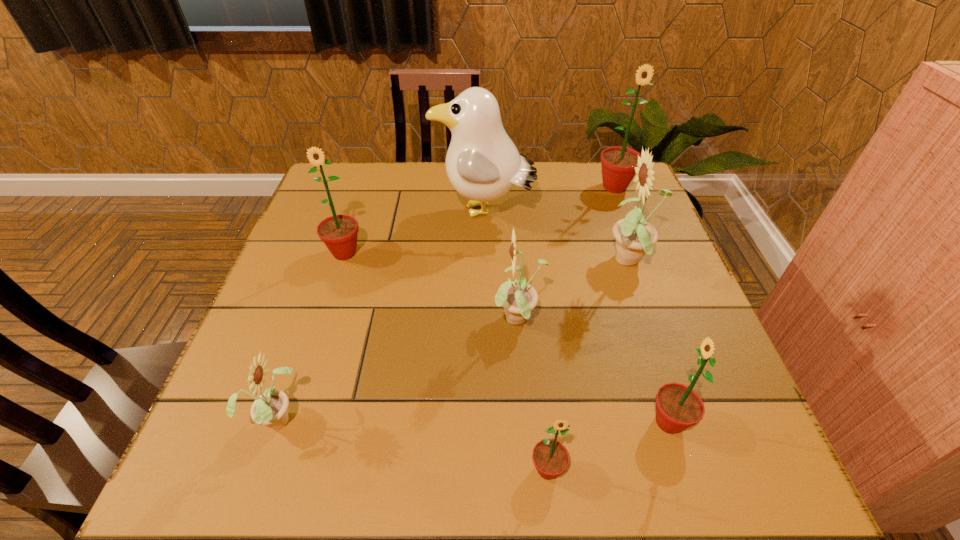
Identify which object is the sixth nearest to the tallest sunflower. Please provide its 2D coordinates. Your answer should be formatted as a tuple, i.e. [(x, y)], where the tuple contains the x and y coordinates of a point satisfying the conditions above.

[(550, 457)]

Identify which sunflower is located as the nearest to the third green sunflower from right to left. Please provide its 2D coordinates. Your answer should be formatted as a tuple, i.e. [(x, y)], where the tuple contains the x and y coordinates of a point satisfying the conditions above.

[(678, 407)]

Identify which sunflower is located as the nearest to the farthest green sunflower. Please provide its 2D coordinates. Your answer should be formatted as a tuple, i.e. [(x, y)], where the tuple contains the x and y coordinates of a point satisfying the conditions above.

[(635, 237)]

Locate an element on the screen. Image resolution: width=960 pixels, height=540 pixels. green sunflower that can be found as the third closest to the third biggest green sunflower is located at coordinates (339, 233).

Identify which green sunflower is the closest to the third biggest green sunflower. Please provide its 2D coordinates. Your answer should be formatted as a tuple, i.e. [(x, y)], where the tuple contains the x and y coordinates of a point satisfying the conditions above.

[(550, 457)]

Locate an element on the screen. The width and height of the screenshot is (960, 540). the closest yellow sunflower to the second yellow sunflower from left to right is located at coordinates (635, 237).

Locate which yellow sunflower is the second closest to the farthest yellow sunflower. Please provide its 2D coordinates. Your answer should be formatted as a tuple, i.e. [(x, y)], where the tuple contains the x and y coordinates of a point satisfying the conditions above.

[(270, 408)]

The height and width of the screenshot is (540, 960). I want to click on vacant position in the image that satisfies the following two spatial constraints: 1. on the face of the farthest green sunflower; 2. on the front-facing side of the nearest yellow sunflower, so click(x=703, y=417).